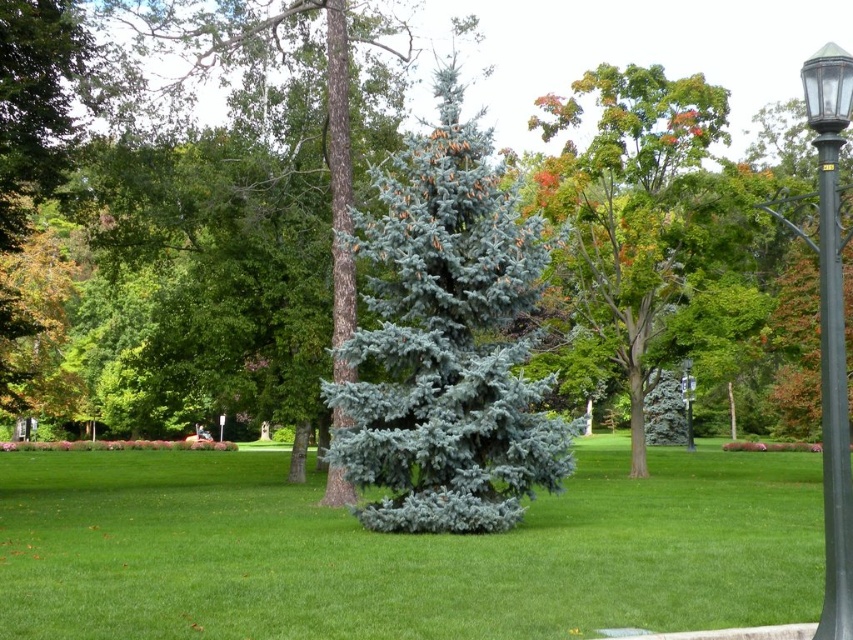
You are standing at point (399, 552) in the park. What do you see under your feet?

At point (399, 552) lies green grass at center.